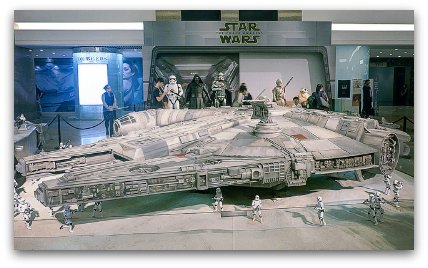
This screenshot has height=268, width=428. I want to click on hallway, so click(388, 107), click(49, 110).